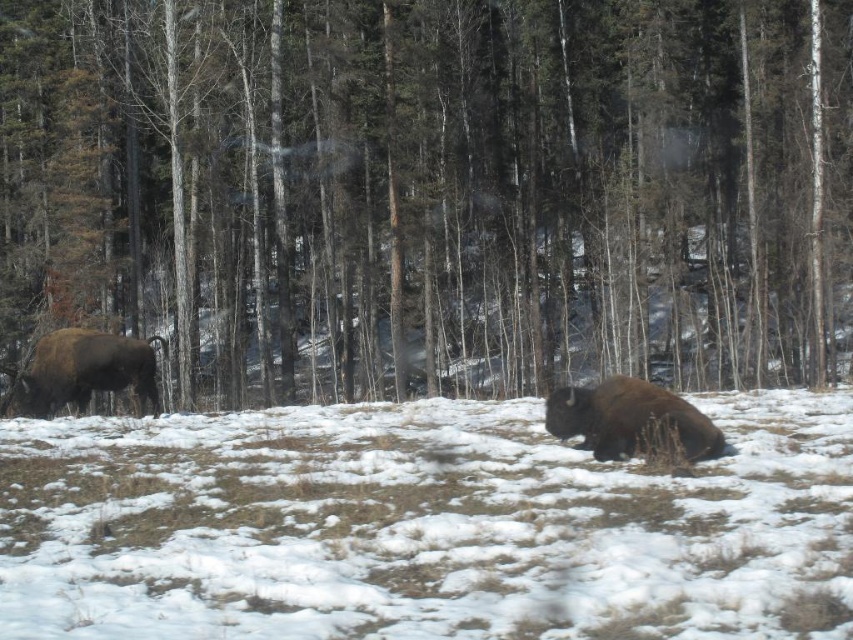
You are standing in the winter forest scene and want to take a photo of the brown wood tree at left. Where should you position yourself to capture it in the frame?

The brown wood tree at left is located at point (430, 189), so you should position yourself to the left side of the scene to capture it in the frame.

You are navigating a drone through the winter forest scene. You need to fly from the point at coordinates point (793,22) to the point at coordinates point (685,426). Given that the drone can only move forward and backward, will you be able to fly directly towards your destination without changing direction?

Point point (793,22) is behind point point (685,426), so flying directly forward from point point (793,22) towards point point (685,426) would not be possible since the destination is behind your starting position. You would need to adjust your direction to move backward or reposition the drone.